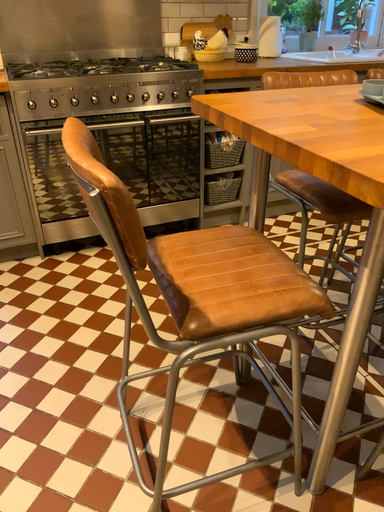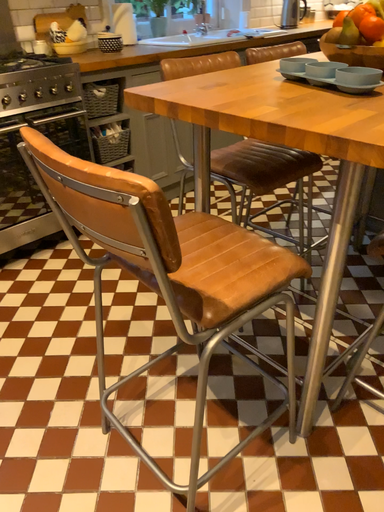
Question: How did the camera likely rotate when shooting the video?

Choices:
 (A) rotated right
 (B) rotated left

Answer: (A)